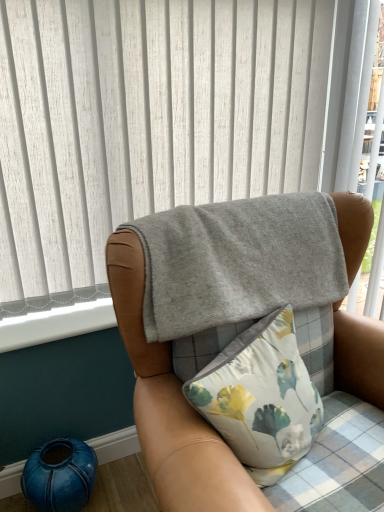
Question: From the image's perspective, does teal ceramic vase at lower left appear lower than white smooth window sill at lower left?

Choices:
 (A) no
 (B) yes

Answer: (B)

Question: Is teal ceramic vase at lower left positioned in front of white smooth window sill at lower left?

Choices:
 (A) yes
 (B) no

Answer: (A)

Question: From a real-world perspective, is teal ceramic vase at lower left on top of white smooth window sill at lower left?

Choices:
 (A) yes
 (B) no

Answer: (B)

Question: From the image's perspective, is teal ceramic vase at lower left located above white smooth window sill at lower left?

Choices:
 (A) yes
 (B) no

Answer: (B)

Question: Does teal ceramic vase at lower left have a larger size compared to white smooth window sill at lower left?

Choices:
 (A) no
 (B) yes

Answer: (B)

Question: Visually, is gray fleece blanket at upper center positioned to the left or to the right of gray felt blanket at upper center?

Choices:
 (A) right
 (B) left

Answer: (A)

Question: Relative to gray felt blanket at upper center, is gray fleece blanket at upper center in front or behind?

Choices:
 (A) front
 (B) behind

Answer: (A)

Question: Does point (233, 508) appear closer or farther from the camera than point (248, 57)?

Choices:
 (A) closer
 (B) farther

Answer: (A)

Question: From the image's perspective, is gray fleece blanket at upper center located above or below gray felt blanket at upper center?

Choices:
 (A) below
 (B) above

Answer: (A)

Question: Considering the positions of gray felt blanket at upper center and floral fabric pillow at center in the image, is gray felt blanket at upper center wider or thinner than floral fabric pillow at center?

Choices:
 (A) thin
 (B) wide

Answer: (A)

Question: Which is correct: gray felt blanket at upper center is inside floral fabric pillow at center, or outside of it?

Choices:
 (A) inside
 (B) outside

Answer: (B)

Question: From a real-world perspective, relative to floral fabric pillow at center, is gray felt blanket at upper center vertically above or below?

Choices:
 (A) above
 (B) below

Answer: (A)

Question: Considering the positions of gray felt blanket at upper center and floral fabric pillow at center in the image, is gray felt blanket at upper center taller or shorter than floral fabric pillow at center?

Choices:
 (A) tall
 (B) short

Answer: (A)

Question: Is point (251, 391) positioned closer to the camera than point (162, 461)?

Choices:
 (A) farther
 (B) closer

Answer: (A)

Question: Considering the positions of floral fabric pillow at center and gray fleece blanket at upper center in the image, is floral fabric pillow at center taller or shorter than gray fleece blanket at upper center?

Choices:
 (A) short
 (B) tall

Answer: (A)